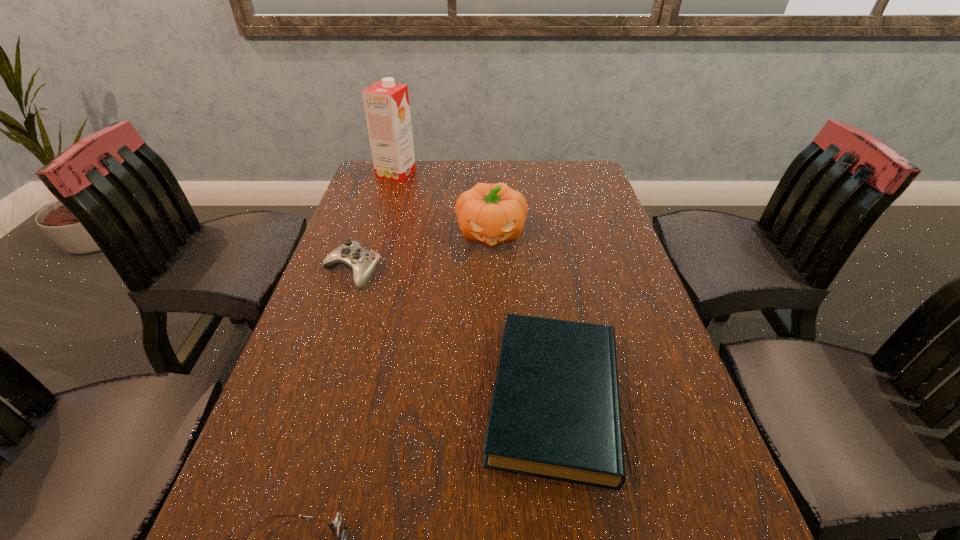
You are a GUI agent. You are given a task and a screenshot of the screen. Output one action in this format:
    pyautogui.click(x=<x>, y=<y>)
    Task: Click on the empty space that is in between the control and the tallest object
    Image resolution: width=960 pixels, height=540 pixels.
    Given the screenshot: What is the action you would take?
    pyautogui.click(x=374, y=222)

You are a GUI agent. You are given a task and a screenshot of the screen. Output one action in this format:
    pyautogui.click(x=<x>, y=<y>)
    Task: Click on the third closest object to the second tallest object
    
    Given the screenshot: What is the action you would take?
    pyautogui.click(x=555, y=413)

This screenshot has width=960, height=540. I want to click on object that stands as the fourth closest to the farthest object, so click(338, 527).

Find the location of a particular element. vacant region that satisfies the following two spatial constraints: 1. on the front side of the book; 2. on the left side of the control is located at coordinates (310, 398).

The image size is (960, 540). Find the location of `vacant point that satisfies the following two spatial constraints: 1. on the carved face of the fourth farthest object; 2. on the right side of the second tallest object`. vacant point that satisfies the following two spatial constraints: 1. on the carved face of the fourth farthest object; 2. on the right side of the second tallest object is located at coordinates (496, 398).

This screenshot has width=960, height=540. I want to click on vacant space that satisfies the following two spatial constraints: 1. on the carved face of the book; 2. on the left side of the pumpkin, so click(x=496, y=398).